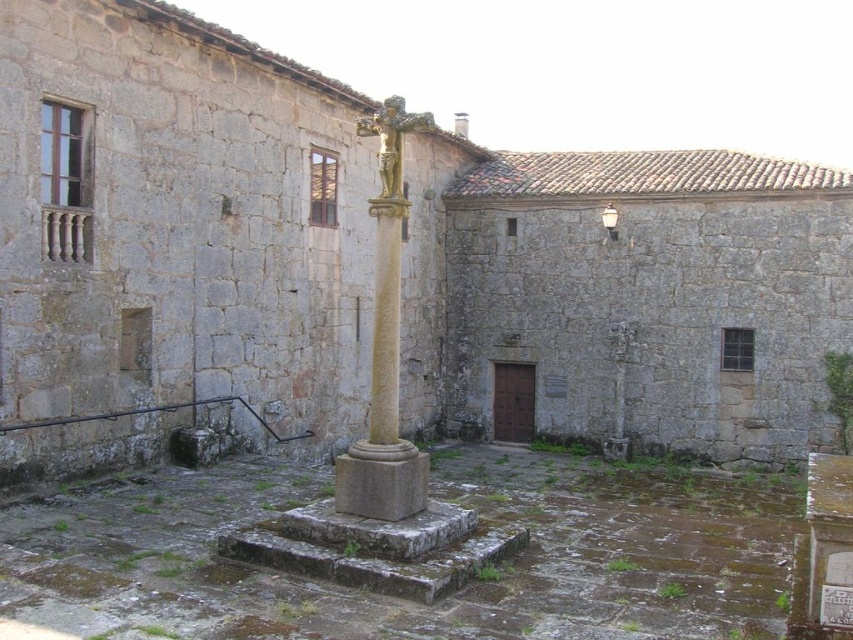
Consider the image. You are a visitor in the courtyard and want to take a photo of the smooth stone cross at center without any obstructions. Is the white ceramic lamp post at upper center blocking the view of the cross?

The smooth stone cross at center is positioned under the white ceramic lamp post at upper center, so the lamp post is blocking the view of the cross.

You are an architect visiting the courtyard and need to determine the tallest object between the smooth stone cross at center and the white ceramic lamp post at upper center. Which one is taller?

The smooth stone cross at center is much taller than the white ceramic lamp post at upper center, so the smooth stone cross at center is the tallest object between them.

You are standing in the old stone courtyard and want to find the exact location of the point at coordinates (386,348). Based on the description, where is this point located?

The point at coordinates (386,348) is located on the smooth stone cross at center.